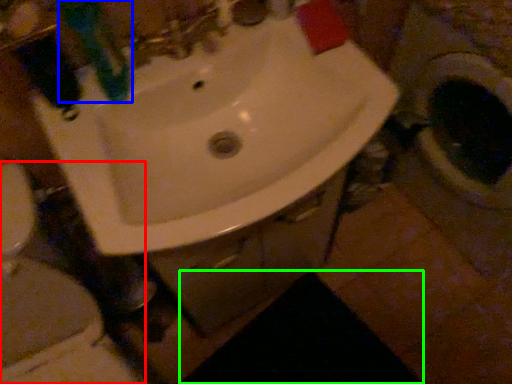
Question: Based on their relative distances, which object is farther from toilet (highlighted by a red box)? Choose from toothbrush (highlighted by a blue box) and dark (highlighted by a green box).

Choices:
 (A) toothbrush
 (B) dark

Answer: (B)